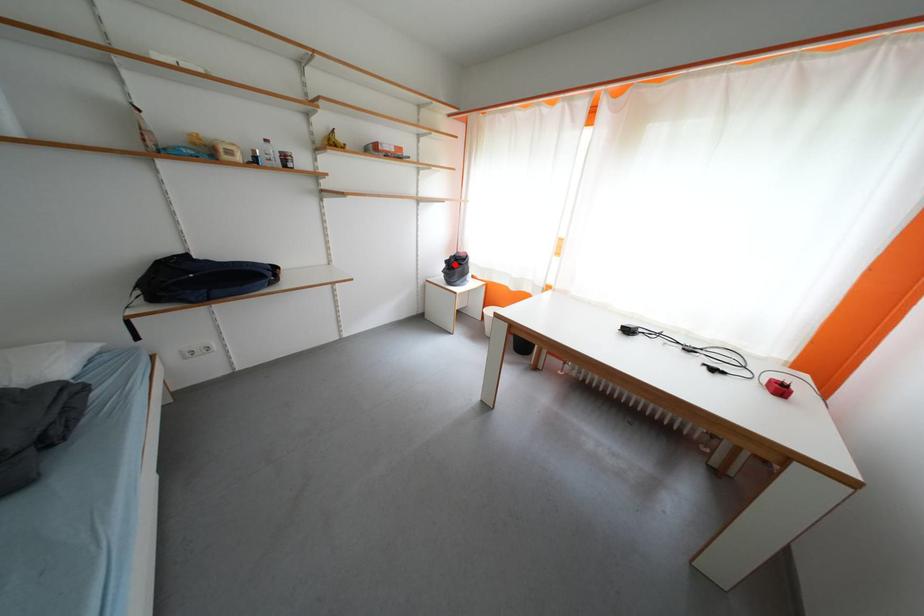
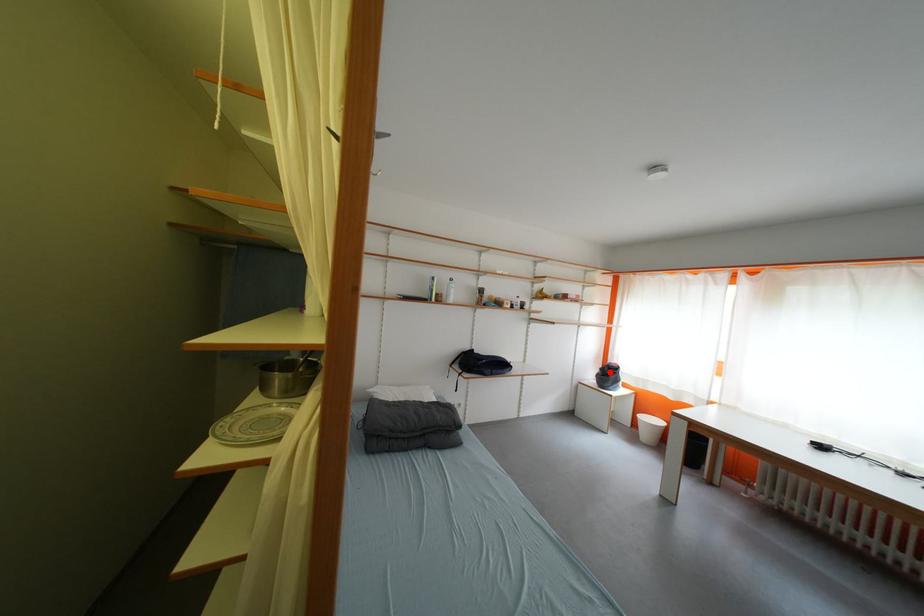
I am providing you with two images of the same scene from different viewpoints. A red point is marked on the first image and another point is marked on the second image. Is the marked point in image1 the same physical position as the marked point in image2?

Yes